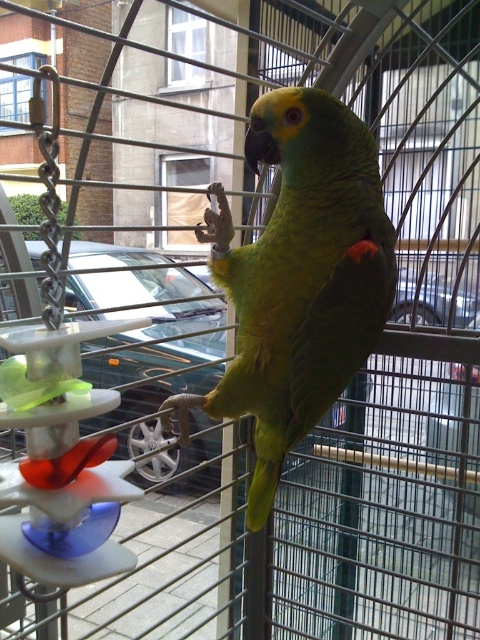
Which is behind, point (280, 456) or point (202, 280)?

Positioned behind is point (202, 280).

Does green matte parrot at center appear under metallic silver car at center?

Correct, green matte parrot at center is located below metallic silver car at center.

This screenshot has height=640, width=480. I want to click on green matte parrot at center, so click(x=299, y=278).